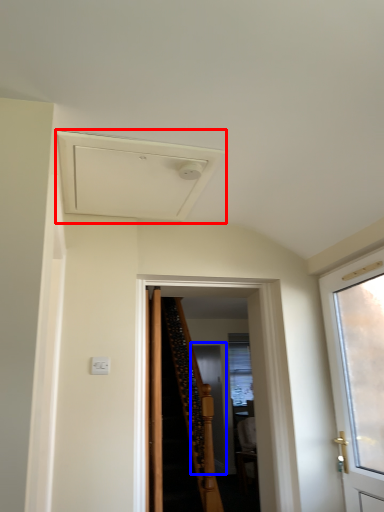
Question: Which object appears closest to the camera in this image, exhaust hood (highlighted by a red box) or screen door (highlighted by a blue box)?

Choices:
 (A) exhaust hood
 (B) screen door

Answer: (A)